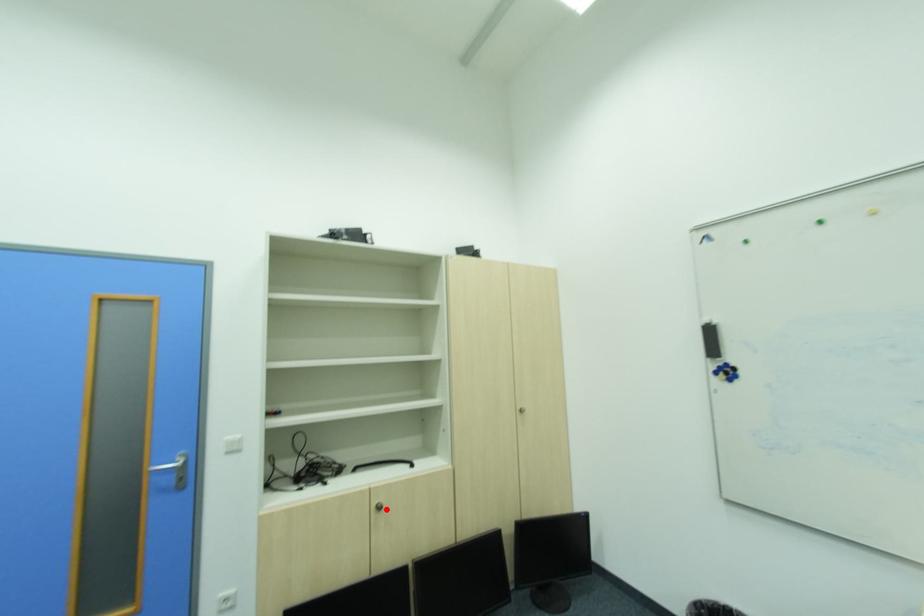
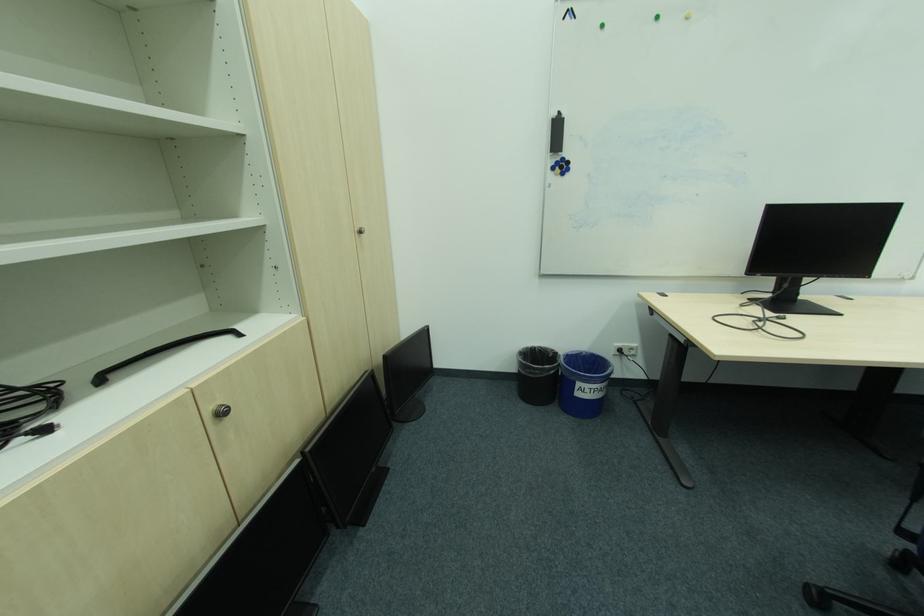
Question: I am providing you with two images of the same scene from different viewpoints. A red point is shown in image1. For the corresponding object point in image2, is it positioned nearer or farther from the camera?

Choices:
 (A) Nearer
 (B) Farther

Answer: (A)